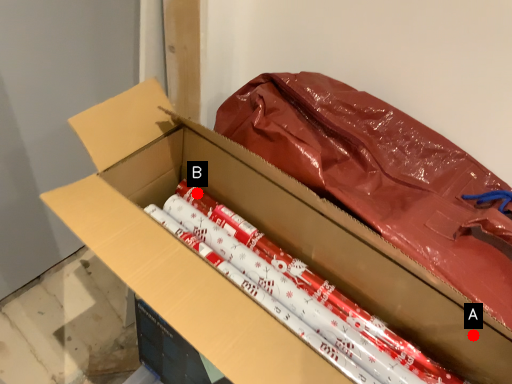
Question: Two points are circled on the image, labeled by A and B beside each circle. Which point is farther from the camera taking this photo?

Choices:
 (A) A is further
 (B) B is further

Answer: (B)